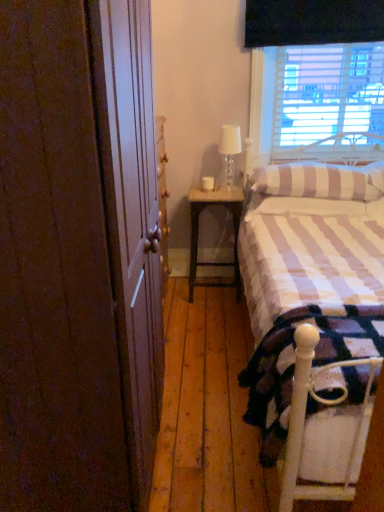
The width and height of the screenshot is (384, 512). What are the coordinates of `wooden nightstand at center` in the screenshot? It's located at (198, 232).

The width and height of the screenshot is (384, 512). I want to click on translucent glass table lamp at upper right, so click(229, 150).

Measure the distance between white metal bed frame at lower right and camera.

They are 1.03 meters apart.

At what (x,y) coordinates should I click in order to perform the action: click on wooden nightstand at center. Please return your answer as a coordinate pair (x, y). This screenshot has width=384, height=512. Looking at the image, I should click on [198, 232].

Do you think translucent glass table lamp at upper right is within white metal bed frame at lower right, or outside of it?

translucent glass table lamp at upper right is not enclosed by white metal bed frame at lower right.

From the image's perspective, which object appears higher, translucent glass table lamp at upper right or white metal bed frame at lower right?

translucent glass table lamp at upper right.

Which object is thinner, translucent glass table lamp at upper right or white metal bed frame at lower right?

translucent glass table lamp at upper right is thinner.

Is translucent glass table lamp at upper right facing away from white metal bed frame at lower right?

No.

In the scene shown: Is brown wood screen door at left not close to white textured bed at right?

brown wood screen door at left is near white textured bed at right, not far away.

How distant is brown wood screen door at left from white textured bed at right?

brown wood screen door at left and white textured bed at right are 37.92 inches apart from each other.

Is white textured bed at right a part of brown wood screen door at left?

That's incorrect, white textured bed at right is not inside brown wood screen door at left.

Is brown wood screen door at left positioned with its back to white textured bed at right?

No.

Identify the location of table lamp above the white metal bed frame at lower right (from a real-world perspective). The width and height of the screenshot is (384, 512). [x=229, y=150].

From a real-world perspective, is white metal bed frame at lower right positioned over translucent glass table lamp at upper right based on gravity?

Incorrect, from a real-world perspective, white metal bed frame at lower right is lower than translucent glass table lamp at upper right.

Do you think white metal bed frame at lower right is within translucent glass table lamp at upper right, or outside of it?

white metal bed frame at lower right cannot be found inside translucent glass table lamp at upper right.

Considering the relative sizes of white metal bed frame at lower right and translucent glass table lamp at upper right in the image provided, is white metal bed frame at lower right bigger than translucent glass table lamp at upper right?

Indeed, white metal bed frame at lower right has a larger size compared to translucent glass table lamp at upper right.

Considering the positions of point (218, 195) and point (320, 307), is point (218, 195) closer or farther from the camera than point (320, 307)?

Point (218, 195) is farther from the camera than point (320, 307).

From the image's perspective, which one is positioned lower, wooden nightstand at center or white textured bed at right?

white textured bed at right, from the image's perspective.

Which is more to the left, wooden nightstand at center or white textured bed at right?

wooden nightstand at center.

Is white metal bed frame at lower right in contact with wooden nightstand at center?

No.

From the picture: From the image's perspective, between white metal bed frame at lower right and wooden nightstand at center, who is located below?

From the image's view, white metal bed frame at lower right is below.

How distant is white metal bed frame at lower right from wooden nightstand at center?

white metal bed frame at lower right is 1.66 meters from wooden nightstand at center.

Measure the distance between white textured bed at right and striped fabric pillow at upper right.

white textured bed at right and striped fabric pillow at upper right are 42.67 centimeters apart.

Are white textured bed at right and striped fabric pillow at upper right beside each other?

No, white textured bed at right is not in contact with striped fabric pillow at upper right.

Looking at this image, is striped fabric pillow at upper right at the back of white textured bed at right?

Absolutely, white textured bed at right is directed away from striped fabric pillow at upper right.

The width and height of the screenshot is (384, 512). What are the coordinates of `bed below the striped fabric pillow at upper right (from a real-world perspective)` in the screenshot? It's located at (314, 320).

In the image, is brown wood screen door at left on the left side or the right side of white metal bed frame at lower right?

Clearly, brown wood screen door at left is on the left of white metal bed frame at lower right in the image.

Can we say brown wood screen door at left lies outside white metal bed frame at lower right?

brown wood screen door at left is positioned outside white metal bed frame at lower right.

In order to click on bed frame below the translucent glass table lamp at upper right (from the image's perspective) in this screenshot , I will do `click(323, 432)`.

Locate an element on the screen. bed on the right of brown wood screen door at left is located at coordinates (314, 320).

From the image, which object appears to be farther from translucent glass table lamp at upper right, brown wood screen door at left or striped fabric pillow at upper right?

brown wood screen door at left.

Estimate the real-world distances between objects in this image. Which object is closer to wooden nightstand at center, striped fabric pillow at upper right or translucent glass table lamp at upper right?

translucent glass table lamp at upper right.

Looking at the image, which one is located closer to white textured bed at right, wooden nightstand at center or striped fabric pillow at upper right?

striped fabric pillow at upper right is positioned closer to the anchor white textured bed at right.

Considering their positions, is white metal bed frame at lower right positioned further to white textured bed at right than brown wood screen door at left?

Among the two, brown wood screen door at left is located further to white textured bed at right.

Which object lies nearer to the anchor point white textured bed at right, white metal bed frame at lower right or translucent glass table lamp at upper right?

white metal bed frame at lower right is closer to white textured bed at right.

Which object lies further to the anchor point brown wood screen door at left, wooden nightstand at center or white metal bed frame at lower right?

wooden nightstand at center is further to brown wood screen door at left.

Estimate the real-world distances between objects in this image. Which object is closer to striped fabric pillow at upper right, brown wood screen door at left or wooden nightstand at center?

wooden nightstand at center lies closer to striped fabric pillow at upper right than the other object.

In the scene shown: Which object lies nearer to the anchor point translucent glass table lamp at upper right, brown wood screen door at left or white textured bed at right?

white textured bed at right lies closer to translucent glass table lamp at upper right than the other object.

At what (x,y) coordinates should I click in order to perform the action: click on pillow between white metal bed frame at lower right and wooden nightstand at center in the front-back direction. Please return your answer as a coordinate pair (x, y). Looking at the image, I should click on (321, 181).

At what (x,y) coordinates should I click in order to perform the action: click on pillow positioned between brown wood screen door at left and wooden nightstand at center from near to far. Please return your answer as a coordinate pair (x, y). Looking at the image, I should click on (321, 181).

You are a GUI agent. You are given a task and a screenshot of the screen. Output one action in this format:
    pyautogui.click(x=<x>, y=<y>)
    Task: Click on the nightstand positioned between brown wood screen door at left and translucent glass table lamp at upper right from near to far
    
    Given the screenshot: What is the action you would take?
    pyautogui.click(x=198, y=232)

This screenshot has height=512, width=384. Find the location of `bed positioned between brown wood screen door at left and wooden nightstand at center from near to far`. bed positioned between brown wood screen door at left and wooden nightstand at center from near to far is located at coordinates click(x=314, y=320).